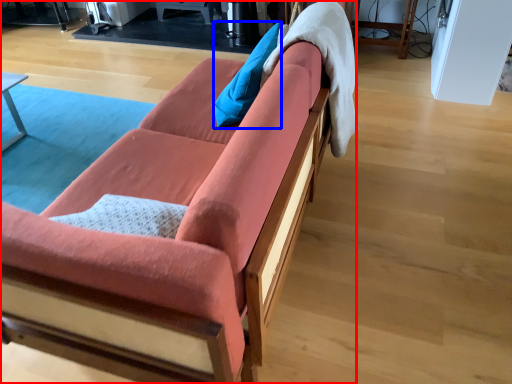
Question: Which of the following is the closest to the observer, studio couch (highlighted by a red box) or pillow (highlighted by a blue box)?

Choices:
 (A) studio couch
 (B) pillow

Answer: (A)